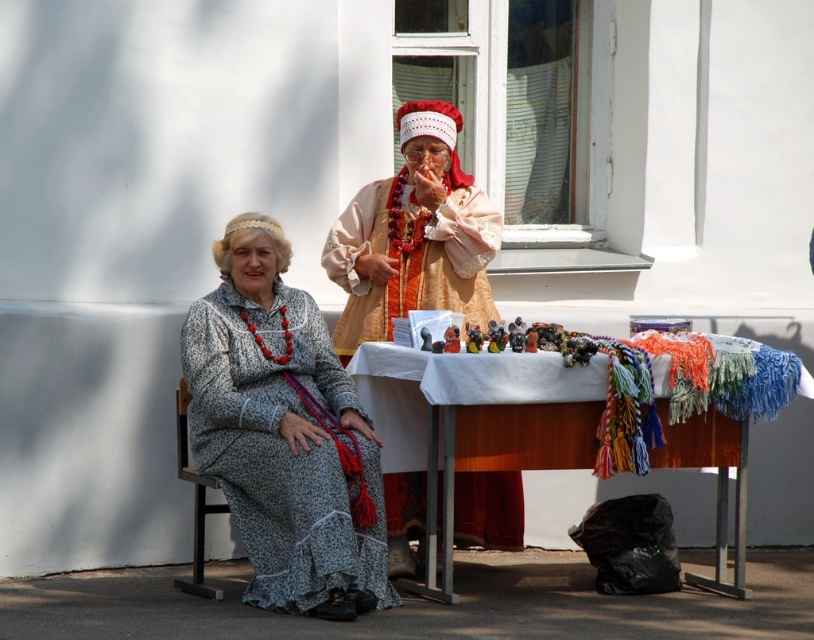
Can you confirm if printed fabric dress at center is shorter than white cloth-covered table at center?

No.

Describe the element at coordinates (283, 433) in the screenshot. I see `printed fabric dress at center` at that location.

Find the location of `printed fabric dress at center`. printed fabric dress at center is located at coordinates (283, 433).

Is white cloth-covered table at center positioned behind matte orange fabric robe at center?

No, white cloth-covered table at center is in front of matte orange fabric robe at center.

Is point (484, 396) farther from viewer compared to point (471, 291)?

No, (484, 396) is closer to viewer.

This screenshot has height=640, width=814. Describe the element at coordinates (478, 417) in the screenshot. I see `white cloth-covered table at center` at that location.

Identify the location of white cloth-covered table at center. The height and width of the screenshot is (640, 814). (478, 417).

Does printed fabric dress at center appear under matte orange fabric robe at center?

Yes.

Who is positioned more to the right, printed fabric dress at center or matte orange fabric robe at center?

From the viewer's perspective, matte orange fabric robe at center appears more on the right side.

You are a GUI agent. You are given a task and a screenshot of the screen. Output one action in this format:
    pyautogui.click(x=<x>, y=<y>)
    Task: Click on the printed fabric dress at center
    This screenshot has height=640, width=814.
    Given the screenshot: What is the action you would take?
    pyautogui.click(x=283, y=433)